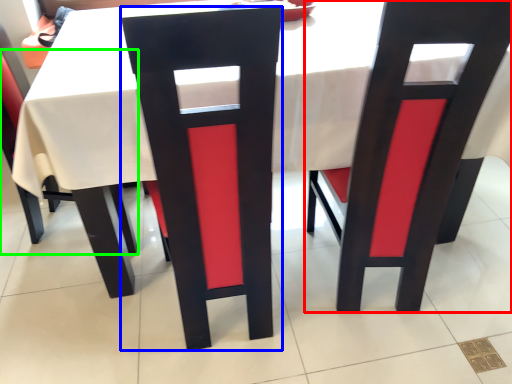
Question: Considering the real-world distances, which object is closest to chair (highlighted by a red box)? chair (highlighted by a blue box) or chair (highlighted by a green box).

Choices:
 (A) chair
 (B) chair

Answer: (A)